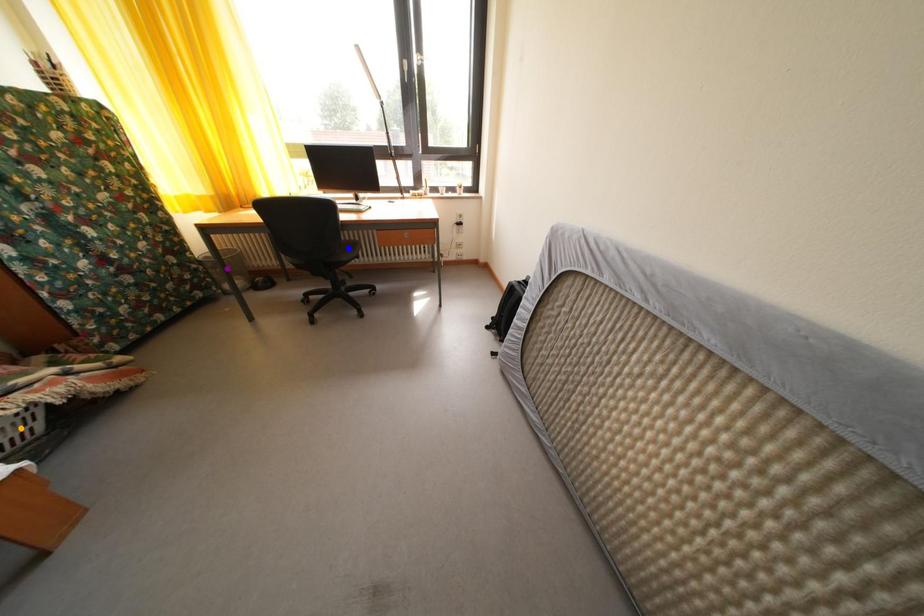
Order these from nearest to farthest:
blue point, purple point, orange point

orange point
purple point
blue point